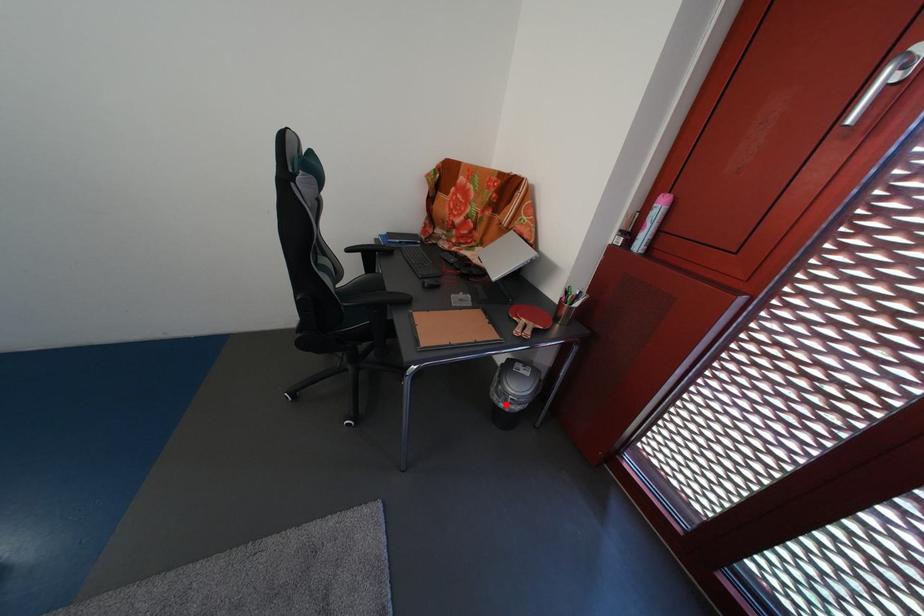
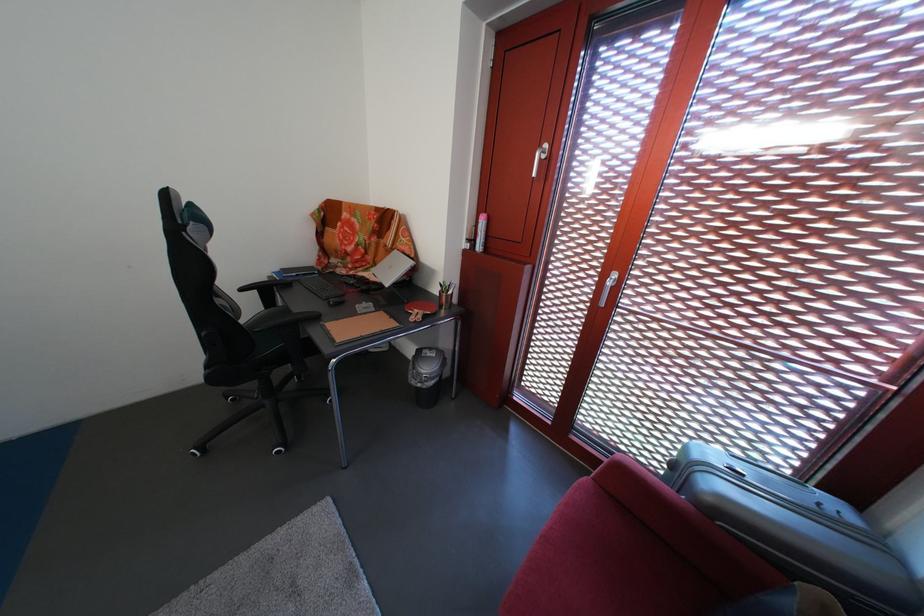
Question: I am providing you with two images of the same scene from different viewpoints. A red point is shown in image1. For the corresponding object point in image2, is it positioned nearer or farther from the camera?

Choices:
 (A) Nearer
 (B) Farther

Answer: (B)